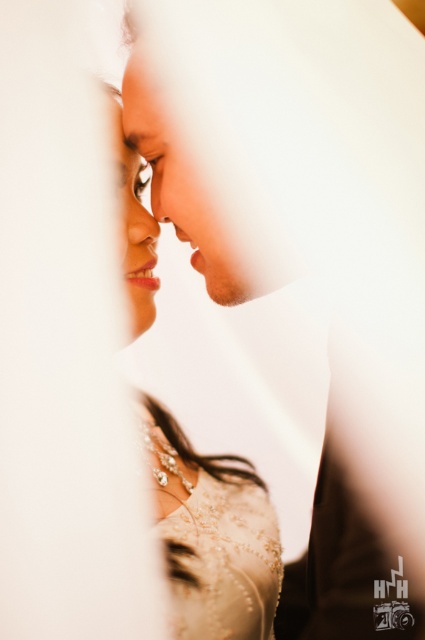
Is point (164, 518) positioned in front of point (221, 593)?

No.

Does point (190, 460) lie behind point (252, 560)?

Yes, point (190, 460) is behind point (252, 560).

Find the location of a particular element. ivory satin dress at center is located at coordinates (212, 536).

Can you confirm if ivory satin dress at center is positioned to the right of smooth skin man at center?

No, ivory satin dress at center is not to the right of smooth skin man at center.

Is ivory satin dress at center above smooth skin man at center?

No, ivory satin dress at center is not above smooth skin man at center.

Measure the distance between point (227,611) and camera.

Point (227,611) is 34.75 inches from camera.

Locate an element on the screen. ivory satin dress at center is located at coordinates (212, 536).

Measure the distance between smooth skin man at center and ivory beaded dress at center.

A distance of 17.25 inches exists between smooth skin man at center and ivory beaded dress at center.

Does smooth skin man at center have a greater height compared to ivory beaded dress at center?

Yes, smooth skin man at center is taller than ivory beaded dress at center.

Which is behind, point (156, 204) or point (226, 545)?

The point (226, 545) is more distant.

At what (x,y) coordinates should I click in order to perform the action: click on smooth skin man at center. Please return your answer as a coordinate pair (x, y). Looking at the image, I should click on (348, 564).